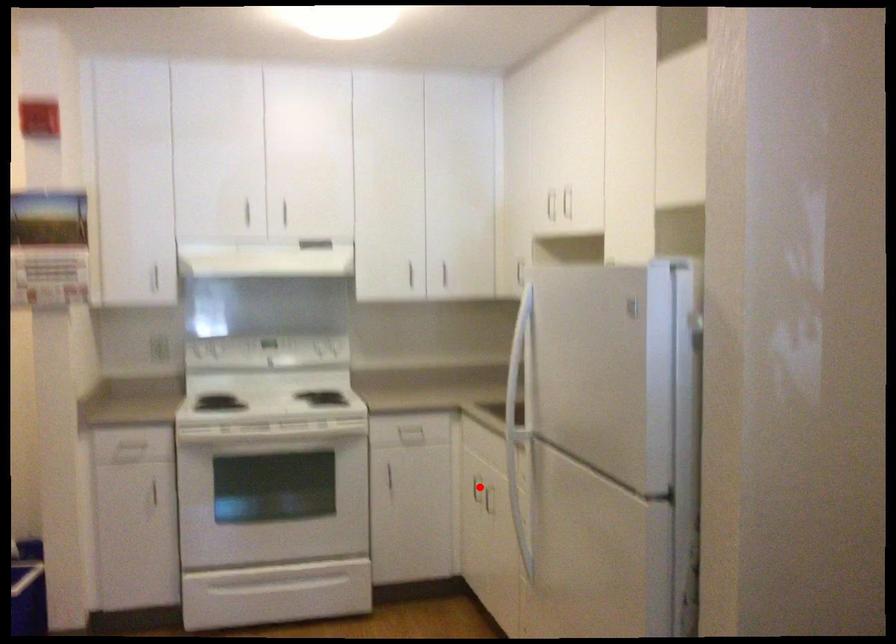
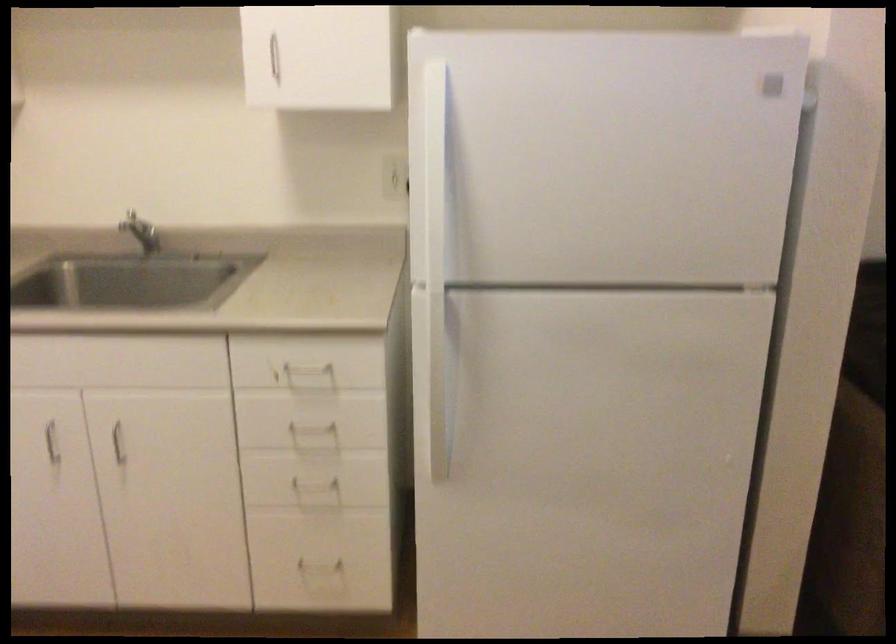
Question: I am providing you with two images of the same scene from different viewpoints. In image1, a red point is highlighted. Considering the same 3D point in image2, which of the following is correct?

Choices:
 (A) It is closer
 (B) It is farther

Answer: (A)